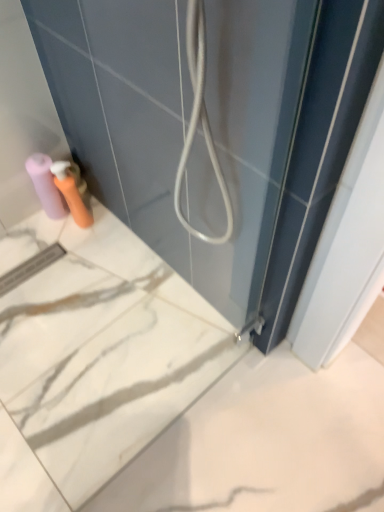
What do you see at coordinates (45, 185) in the screenshot?
I see `matte pink toilet paper at lower left` at bounding box center [45, 185].

The width and height of the screenshot is (384, 512). Find the location of `matte pink toilet paper at lower left`. matte pink toilet paper at lower left is located at coordinates (45, 185).

What is the approximate height of matte plastic soap dispenser at lower left?

It is 10.03 inches.

What do you see at coordinates (71, 193) in the screenshot? This screenshot has width=384, height=512. I see `matte plastic soap dispenser at lower left` at bounding box center [71, 193].

The height and width of the screenshot is (512, 384). I want to click on matte plastic soap dispenser at lower left, so click(x=71, y=193).

Locate an element on the screen. The width and height of the screenshot is (384, 512). matte pink toilet paper at lower left is located at coordinates (45, 185).

Considering the relative positions of matte plastic soap dispenser at lower left and matte pink toilet paper at lower left in the image provided, is matte plastic soap dispenser at lower left to the left or to the right of matte pink toilet paper at lower left?

matte plastic soap dispenser at lower left is positioned on matte pink toilet paper at lower left's right side.

Looking at this image, which object is more forward, matte plastic soap dispenser at lower left or matte pink toilet paper at lower left?

matte plastic soap dispenser at lower left is more forward.

Considering the positions of point (54, 180) and point (63, 213), is point (54, 180) closer or farther from the camera than point (63, 213)?

Point (54, 180) appears to be closer to the viewer than point (63, 213).

From the image's perspective, does matte plastic soap dispenser at lower left appear lower than matte pink toilet paper at lower left?

Yes.

From a real-world perspective, is matte plastic soap dispenser at lower left above or below matte pink toilet paper at lower left?

matte plastic soap dispenser at lower left is situated higher than matte pink toilet paper at lower left in the real world.

Which of these two, matte plastic soap dispenser at lower left or matte pink toilet paper at lower left, is wider?

With larger width is matte pink toilet paper at lower left.

Is matte plastic soap dispenser at lower left taller or shorter than matte pink toilet paper at lower left?

Considering their sizes, matte plastic soap dispenser at lower left has less height than matte pink toilet paper at lower left.

Is matte plastic soap dispenser at lower left bigger than matte pink toilet paper at lower left?

No.

Is matte pink toilet paper at lower left inside matte plastic soap dispenser at lower left?

No, matte plastic soap dispenser at lower left does not contain matte pink toilet paper at lower left.

Are matte plastic soap dispenser at lower left and matte pink toilet paper at lower left located far from each other?

matte plastic soap dispenser at lower left is near matte pink toilet paper at lower left, not far away.

Does matte plastic soap dispenser at lower left turn towards matte pink toilet paper at lower left?

No.

Can you tell me how much matte plastic soap dispenser at lower left and matte pink toilet paper at lower left differ in facing direction?

The facing directions of matte plastic soap dispenser at lower left and matte pink toilet paper at lower left are 0.000393 degrees apart.

How much distance is there between matte plastic soap dispenser at lower left and matte pink toilet paper at lower left?

matte plastic soap dispenser at lower left and matte pink toilet paper at lower left are 2.36 inches apart from each other.

In order to click on toilet paper that appears behind the matte plastic soap dispenser at lower left in this screenshot , I will do `click(45, 185)`.

Considering the relative positions of matte pink toilet paper at lower left and matte plastic soap dispenser at lower left in the image provided, is matte pink toilet paper at lower left to the left of matte plastic soap dispenser at lower left from the viewer's perspective?

Yes.

Between matte pink toilet paper at lower left and matte plastic soap dispenser at lower left, which one is positioned behind?

matte pink toilet paper at lower left is further away from the camera.

Is point (54, 189) less distant than point (87, 221)?

Yes, point (54, 189) is in front of point (87, 221).

From the image's perspective, between matte pink toilet paper at lower left and matte plastic soap dispenser at lower left, who is located below?

matte plastic soap dispenser at lower left is shown below in the image.

From a real-world perspective, who is located lower, matte pink toilet paper at lower left or matte plastic soap dispenser at lower left?

In real-world perspective, matte pink toilet paper at lower left is lower.

Considering the relative sizes of matte pink toilet paper at lower left and matte plastic soap dispenser at lower left in the image provided, is matte pink toilet paper at lower left wider than matte plastic soap dispenser at lower left?

Correct, the width of matte pink toilet paper at lower left exceeds that of matte plastic soap dispenser at lower left.

Can you confirm if matte pink toilet paper at lower left is taller than matte plastic soap dispenser at lower left?

Yes, matte pink toilet paper at lower left is taller than matte plastic soap dispenser at lower left.

Based on their sizes in the image, would you say matte pink toilet paper at lower left is bigger or smaller than matte plastic soap dispenser at lower left?

matte pink toilet paper at lower left is bigger than matte plastic soap dispenser at lower left.

Is matte pink toilet paper at lower left located outside matte plastic soap dispenser at lower left?

Indeed, matte pink toilet paper at lower left is completely outside matte plastic soap dispenser at lower left.

Is matte pink toilet paper at lower left next to matte plastic soap dispenser at lower left and touching it?

Indeed, matte pink toilet paper at lower left and matte plastic soap dispenser at lower left are beside each other and touching.

Consider the image. Is matte pink toilet paper at lower left positioned with its back to matte plastic soap dispenser at lower left?

matte pink toilet paper at lower left does not have its back to matte plastic soap dispenser at lower left.

You are a GUI agent. You are given a task and a screenshot of the screen. Output one action in this format:
    pyautogui.click(x=<x>, y=<y>)
    Task: Click on the toilet paper behind the matte plastic soap dispenser at lower left
    
    Given the screenshot: What is the action you would take?
    45,185

Find the location of a particular element. This screenshot has height=512, width=384. toilet paper above the matte plastic soap dispenser at lower left (from the image's perspective) is located at coordinates coord(45,185).

Where is `toiletry in front of the matte pink toilet paper at lower left`? The height and width of the screenshot is (512, 384). toiletry in front of the matte pink toilet paper at lower left is located at coordinates (71, 193).